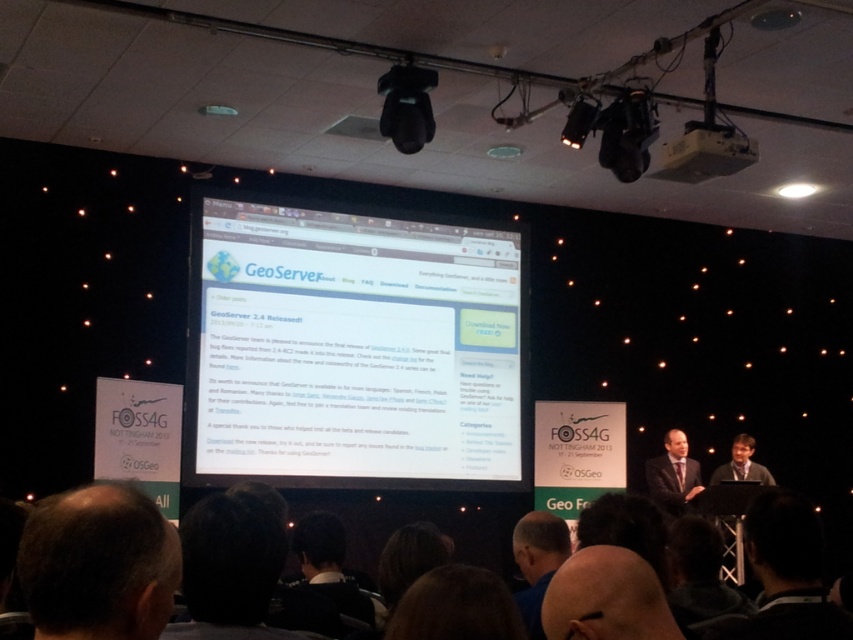
Locate an element on the screen. dark suit at center is located at coordinates (672, 472).

Does dark suit at center have a lesser width compared to matte black laptop at center?

Yes, dark suit at center is thinner than matte black laptop at center.

Which is in front, point (677, 468) or point (735, 442)?

Point (677, 468) is more forward.

At what (x,y) coordinates should I click in order to perform the action: click on dark suit at center. Please return your answer as a coordinate pair (x, y). This screenshot has height=640, width=853. Looking at the image, I should click on (672, 472).

Based on the photo, which is below, dark gray suit at lower right or white plastic projector at upper center?

Positioned lower is dark gray suit at lower right.

Who is shorter, dark gray suit at lower right or white plastic projector at upper center?

Standing shorter between the two is white plastic projector at upper center.

Between point (815, 586) and point (729, 134), which one is positioned behind?

The point (729, 134) is behind.

Where is `dark gray suit at lower right`? This screenshot has width=853, height=640. dark gray suit at lower right is located at coordinates (785, 573).

Consider the image. Is bald head at lower center to the left of blue shirt at lower center from the viewer's perspective?

No, bald head at lower center is not to the left of blue shirt at lower center.

Does bald head at lower center have a lesser height compared to blue shirt at lower center?

Yes.

Is point (553, 598) less distant than point (540, 624)?

Yes.

Locate an element on the screen. The image size is (853, 640). bald head at lower center is located at coordinates (606, 598).